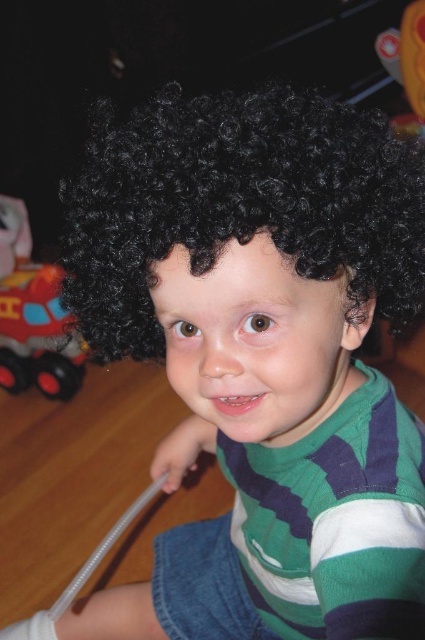
Is point (393, 147) less distant than point (5, 241)?

That is True.

Measure the distance between black curly wig at center and rubberized red truck at lower left.

A distance of 1.29 meters exists between black curly wig at center and rubberized red truck at lower left.

Which is behind, point (119, 120) or point (30, 292)?

Point (119, 120)

Locate an element on the screen. The width and height of the screenshot is (425, 640). black curly wig at center is located at coordinates (238, 204).